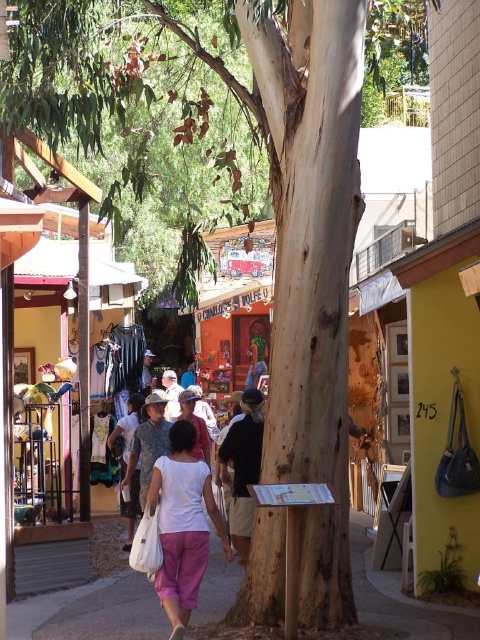
Which is above, smooth concrete sidewalk at center or white cotton shirt at center?

Positioned higher is white cotton shirt at center.

Where is `smooth concrete sidewalk at center`? This screenshot has height=640, width=480. smooth concrete sidewalk at center is located at coordinates (91, 611).